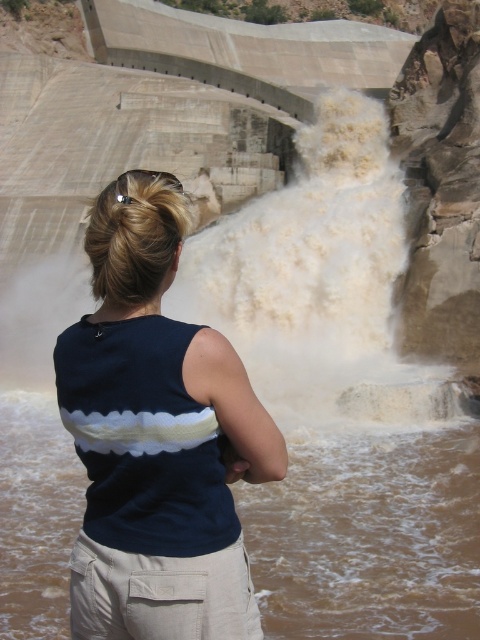
Does brown muddy water at lower center have a greater width compared to white frothy water at center?

Yes.

Between brown muddy water at lower center and white frothy water at center, which one has less height?

Standing shorter between the two is brown muddy water at lower center.

Measure the distance between brown muddy water at lower center and camera.

brown muddy water at lower center is 98.29 feet from camera.

This screenshot has height=640, width=480. I want to click on brown muddy water at lower center, so click(369, 536).

Which of these two, navy blue fabric shirt at center or white frothy water at center, stands shorter?

Standing shorter between the two is navy blue fabric shirt at center.

Does point (130, 420) come in front of point (288, 365)?

Yes.

Find the location of a particular element. navy blue fabric shirt at center is located at coordinates (156, 436).

Find the location of a particular element. The height and width of the screenshot is (640, 480). navy blue fabric shirt at center is located at coordinates (156, 436).

Does navy blue fabric shirt at center have a lesser height compared to brown muddy water at lower center?

No, navy blue fabric shirt at center is not shorter than brown muddy water at lower center.

Does navy blue fabric shirt at center have a lesser width compared to brown muddy water at lower center?

Indeed, navy blue fabric shirt at center has a lesser width compared to brown muddy water at lower center.

Describe the element at coordinates (156, 436) in the screenshot. I see `navy blue fabric shirt at center` at that location.

Find the location of `navy blue fabric shirt at center`. navy blue fabric shirt at center is located at coordinates (156, 436).